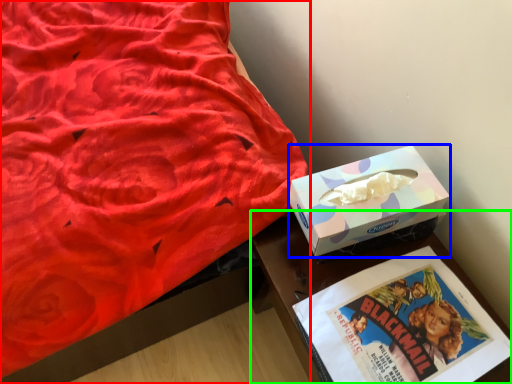
Question: Which object is the closest to the bed (highlighted by a red box)? Choose among these: box (highlighted by a blue box) or table (highlighted by a green box).

Choices:
 (A) box
 (B) table

Answer: (B)